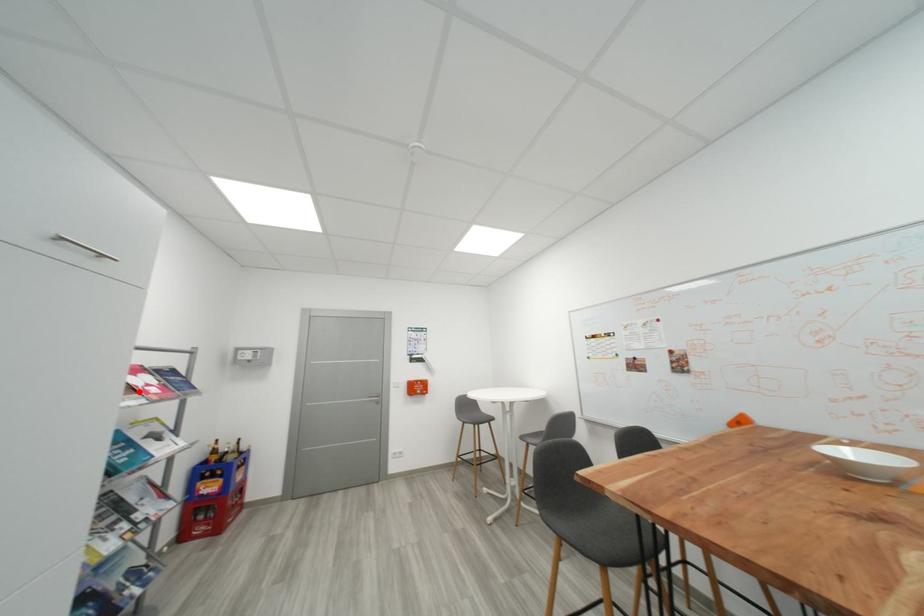
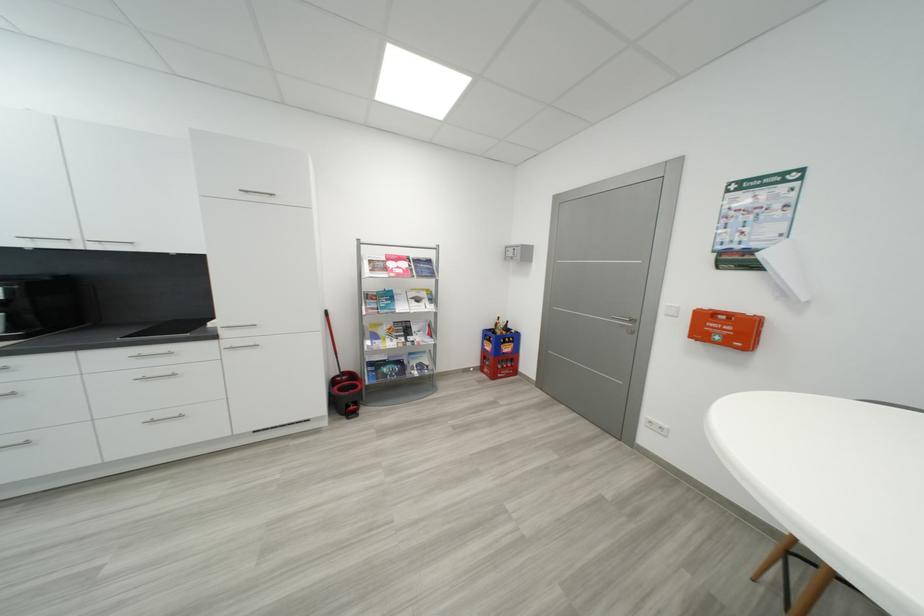
In the second image, find the point that corresponds to the highlighted location in the first image.

(393, 270)